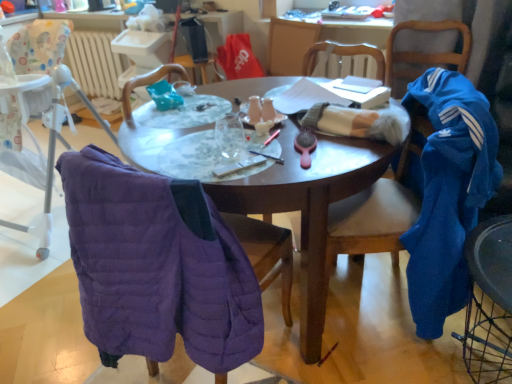
You are a GUI agent. You are given a task and a screenshot of the screen. Output one action in this format:
    pyautogui.click(x=<x>, y=<y>)
    Task: Click on the free space to the left of velvet blue chair at right, which ranks as the 2th chair in right-to-left order
    
    Given the screenshot: What is the action you would take?
    click(x=378, y=361)